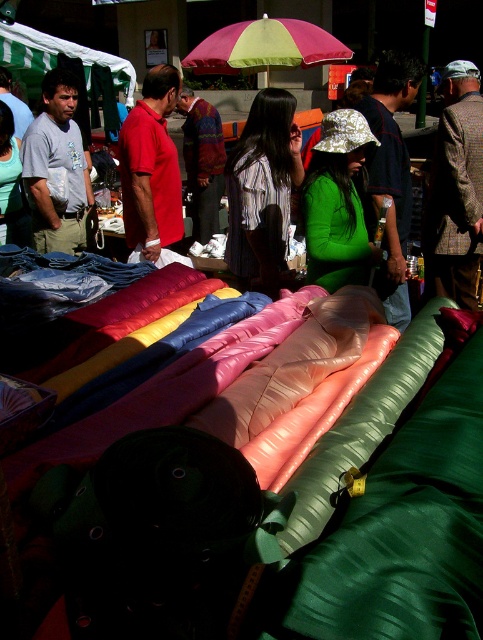
Who is more distant from viewer, (245, 122) or (336, 45)?

The point (245, 122) is more distant.

Does striped shirt at center come behind yellow-green fabric umbrella at upper center?

No, striped shirt at center is in front of yellow-green fabric umbrella at upper center.

Locate an element on the screen. This screenshot has height=640, width=483. striped shirt at center is located at coordinates (263, 188).

Does striped shirt at center appear over matte red polo shirt at left?

No.

Who is lower down, striped shirt at center or matte red polo shirt at left?

Positioned lower is striped shirt at center.

Is point (246, 262) positioned in front of point (155, 140)?

Yes.

Find the location of a particular element. striped shirt at center is located at coordinates (263, 188).

Is matte red polo shirt at left positioned at the back of yellow-green fabric umbrella at upper center?

No, it is in front of yellow-green fabric umbrella at upper center.

Who is positioned more to the left, matte red polo shirt at left or yellow-green fabric umbrella at upper center?

From the viewer's perspective, matte red polo shirt at left appears more on the left side.

Which is behind, point (156, 134) or point (229, 60)?

Positioned behind is point (229, 60).

This screenshot has height=640, width=483. I want to click on matte red polo shirt at left, so click(x=152, y=166).